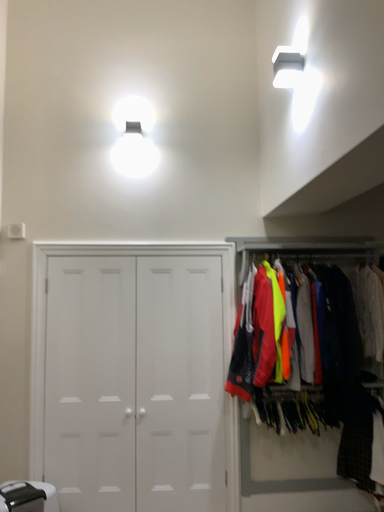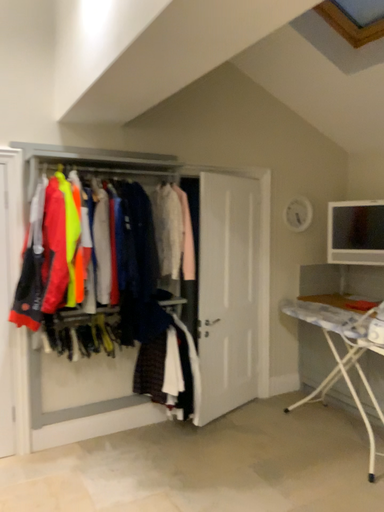
Question: Which way did the camera rotate in the video?

Choices:
 (A) rotated left
 (B) rotated right

Answer: (B)